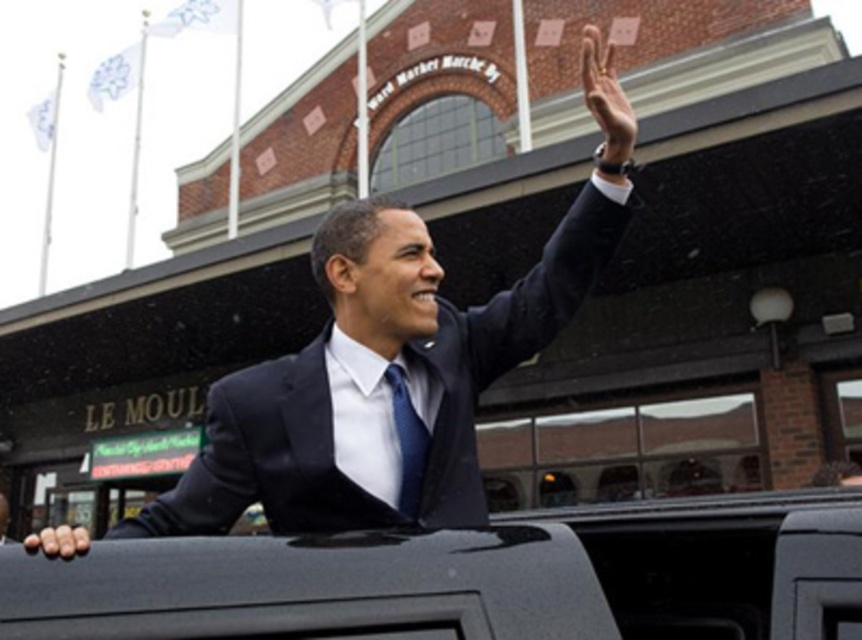
You are a photographer trying to capture both the black matte suit at center and the black smooth suit at upper right in the same frame. The minimum distance between the two suits that your camera can focus on is 3 meters. Will you be able to capture both in focus?

The black matte suit at center is 2.90 meters from the black smooth suit at upper right, which is less than the 3 meters required for the camera to focus on both. Therefore, you might not be able to capture both in focus simultaneously.